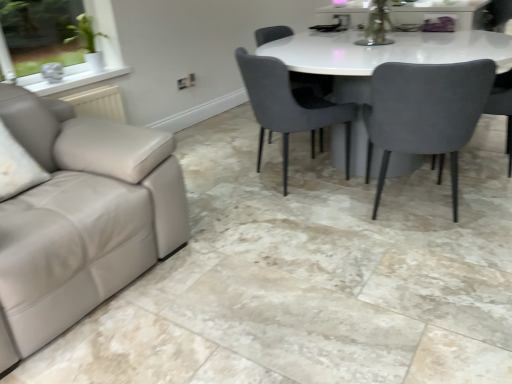
Question: Does velvet grey chair at center, which is the 1th chair from left to right, appear on the left side of velvet grey chair at right, which ranks as the 1th chair in right-to-left order?

Choices:
 (A) no
 (B) yes

Answer: (B)

Question: Is velvet grey chair at center, which appears as the 4th chair when viewed from the right, completely or partially outside of velvet grey chair at right, acting as the 4th chair starting from the left?

Choices:
 (A) no
 (B) yes

Answer: (B)

Question: Does velvet grey chair at center, which is the 1th chair from left to right, turn towards velvet grey chair at right, acting as the 4th chair starting from the left?

Choices:
 (A) yes
 (B) no

Answer: (A)

Question: Can you confirm if velvet grey chair at center, which is the 1th chair from left to right, is positioned to the right of velvet grey chair at right, acting as the 4th chair starting from the left?

Choices:
 (A) yes
 (B) no

Answer: (B)

Question: Does velvet grey chair at center, which is the 1th chair from left to right, have a smaller size compared to velvet grey chair at right, which ranks as the 1th chair in right-to-left order?

Choices:
 (A) yes
 (B) no

Answer: (B)

Question: Considering the positions of velvet grey chair at right, which ranks as the 1th chair in right-to-left order, and velvet grey chair at center, positioned as the third chair in right-to-left order, in the image, is velvet grey chair at right, which ranks as the 1th chair in right-to-left order, bigger or smaller than velvet grey chair at center, positioned as the third chair in right-to-left order,?

Choices:
 (A) small
 (B) big

Answer: (A)

Question: Is point (495, 112) positioned closer to the camera than point (309, 87)?

Choices:
 (A) farther
 (B) closer

Answer: (A)

Question: From the image's perspective, is velvet grey chair at right, acting as the 4th chair starting from the left, located above or below velvet grey chair at center, positioned as the third chair in right-to-left order?

Choices:
 (A) above
 (B) below

Answer: (B)

Question: Looking at their shapes, would you say velvet grey chair at right, which ranks as the 1th chair in right-to-left order, is wider or thinner than velvet grey chair at center, the second chair viewed from the left?

Choices:
 (A) wide
 (B) thin

Answer: (B)

Question: Is point coord(502,102) positioned closer to the camera than point coord(436,97)?

Choices:
 (A) farther
 (B) closer

Answer: (A)

Question: From their relative heights in the image, would you say velvet grey chair at right, acting as the 4th chair starting from the left, is taller or shorter than suede gray chair at right, marked as the 2th chair in a right-to-left arrangement?

Choices:
 (A) tall
 (B) short

Answer: (B)

Question: From a real-world perspective, relative to suede gray chair at right, marked as the 2th chair in a right-to-left arrangement, is velvet grey chair at right, which ranks as the 1th chair in right-to-left order, vertically above or below?

Choices:
 (A) below
 (B) above

Answer: (A)

Question: From the image's perspective, is velvet grey chair at right, which ranks as the 1th chair in right-to-left order, located above or below suede gray chair at right, marked as the 2th chair in a right-to-left arrangement?

Choices:
 (A) above
 (B) below

Answer: (A)

Question: Do you think velvet grey chair at center, positioned as the third chair in right-to-left order, is within suede gray chair at right, marked as the 2th chair in a right-to-left arrangement, or outside of it?

Choices:
 (A) inside
 (B) outside

Answer: (B)

Question: From a real-world perspective, relative to suede gray chair at right, arranged as the third chair when viewed from the left, is velvet grey chair at center, the second chair viewed from the left, vertically above or below?

Choices:
 (A) below
 (B) above

Answer: (B)